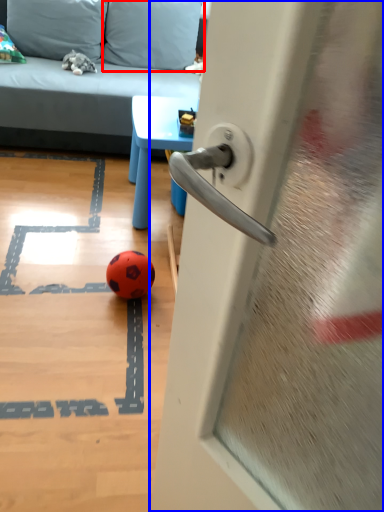
Question: Which of the following is the farthest to the observer, pillow (highlighted by a red box) or door (highlighted by a blue box)?

Choices:
 (A) pillow
 (B) door

Answer: (A)